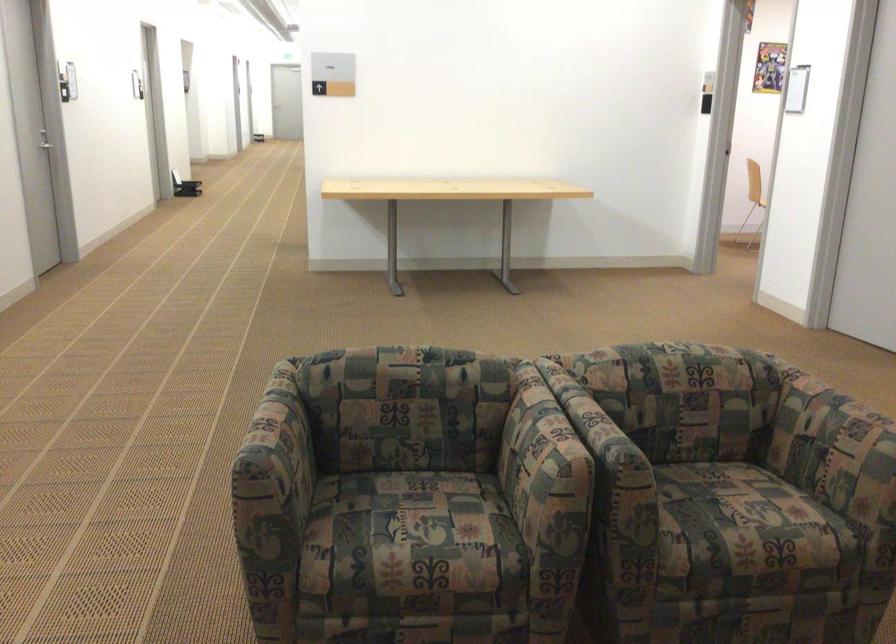
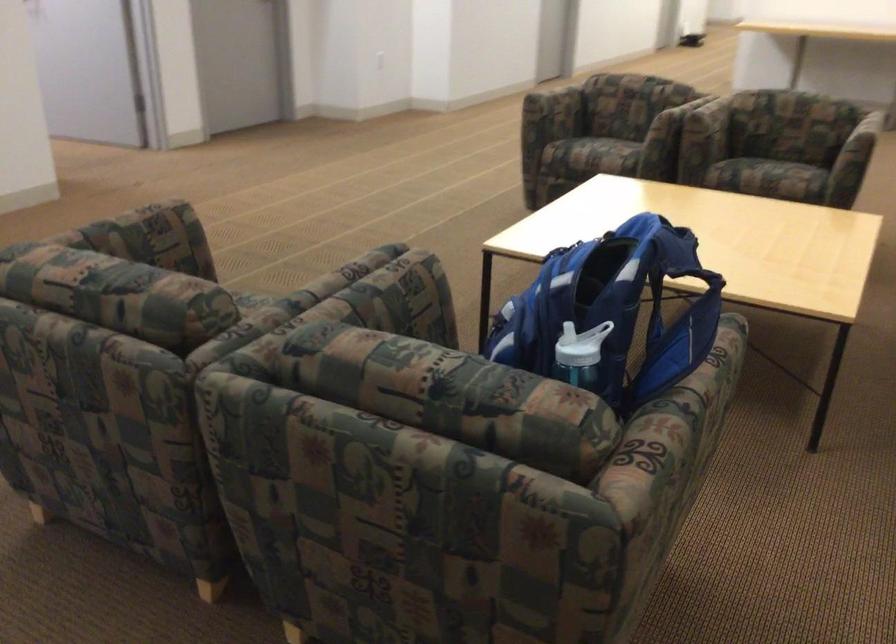
Locate, in the second image, the point that corresponds to (x=445, y=574) in the first image.

(597, 152)